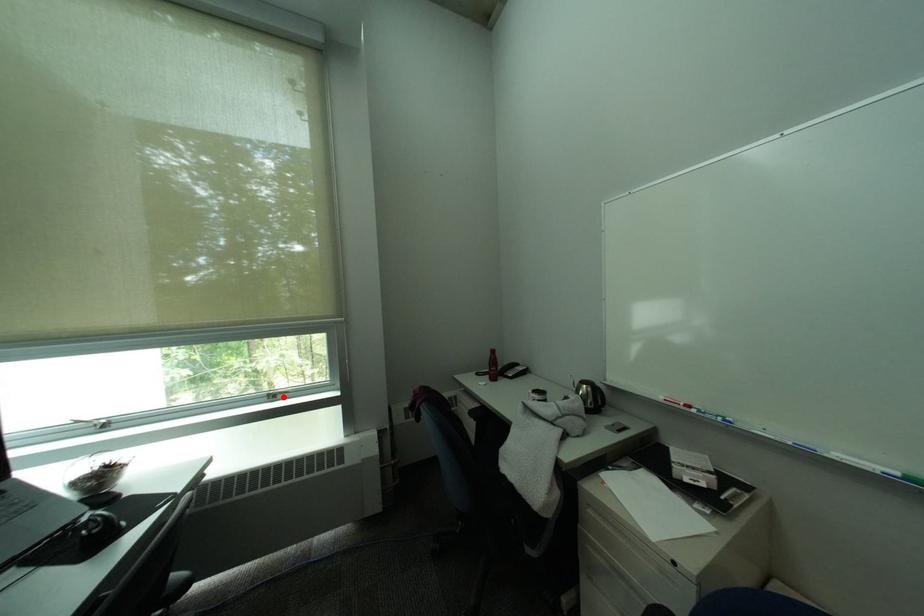
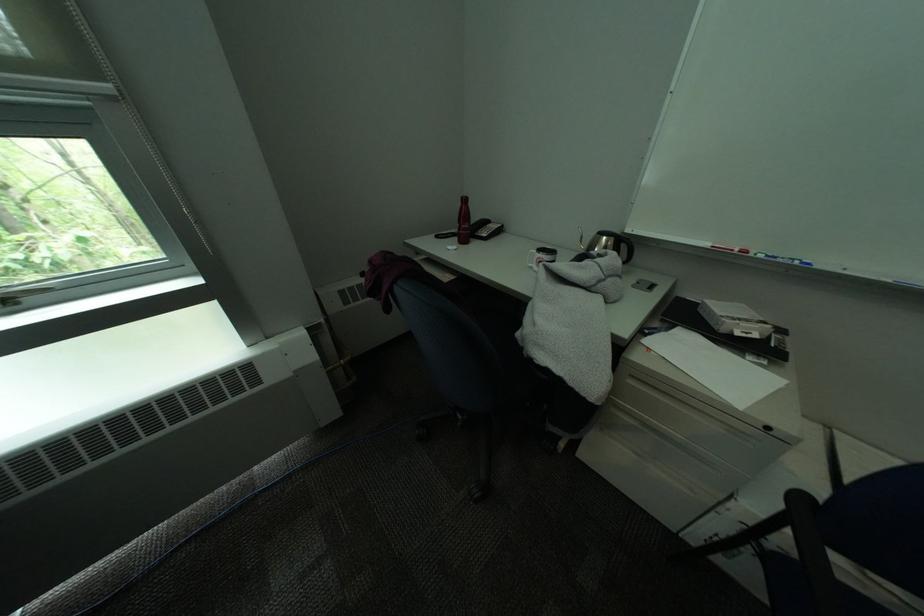
Locate, in the second image, the point that corresponds to the highlighted location in the first image.

(15, 302)